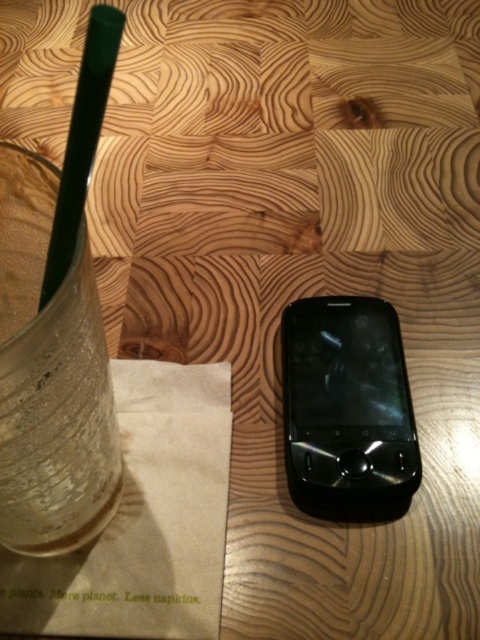
Question: Is clear glass at left above green plastic straw at upper left?

Choices:
 (A) yes
 (B) no

Answer: (B)

Question: Can you confirm if clear glass at left is smaller than green plastic straw at upper left?

Choices:
 (A) yes
 (B) no

Answer: (B)

Question: Among these points, which one is nearest to the camera?

Choices:
 (A) (8, 500)
 (B) (108, 72)
 (C) (320, 410)

Answer: (B)

Question: Which point is closer to the camera?

Choices:
 (A) black glossy smartphone at center
 (B) clear glass at left

Answer: (B)

Question: Is clear glass at left to the right of green plastic straw at upper left from the viewer's perspective?

Choices:
 (A) no
 (B) yes

Answer: (A)

Question: Among these points, which one is farthest from the camera?

Choices:
 (A) (72, 124)
 (B) (361, 429)
 (C) (81, 435)

Answer: (B)